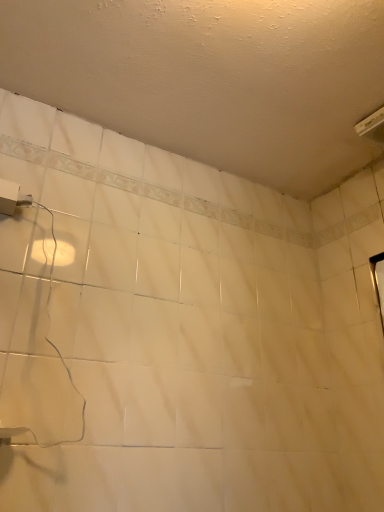
Describe the element at coordinates (12, 197) in the screenshot. I see `white plastic electric outlet at upper left` at that location.

Locate an element on the screen. This screenshot has width=384, height=512. white plastic electric outlet at upper left is located at coordinates (x=12, y=197).

I want to click on white plastic electric outlet at upper left, so click(x=12, y=197).